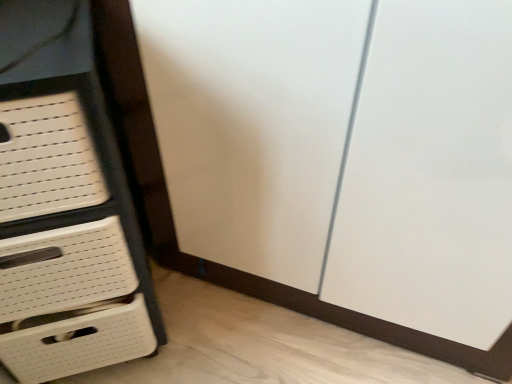
Find the location of `white woven chest of drawers at left`. white woven chest of drawers at left is located at coordinates (65, 207).

The width and height of the screenshot is (512, 384). What do you see at coordinates (65, 207) in the screenshot?
I see `white woven chest of drawers at left` at bounding box center [65, 207].

Where is `white woven chest of drawers at left`? white woven chest of drawers at left is located at coordinates (65, 207).